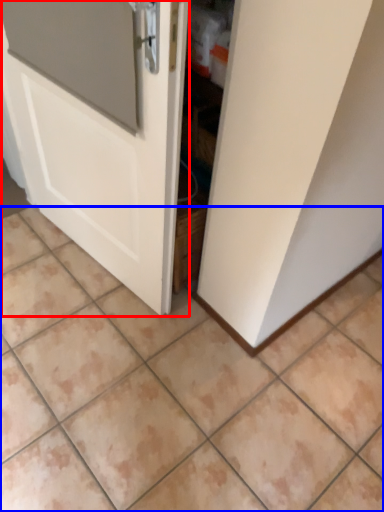
Question: Which object appears farthest to the camera in this image, door (highlighted by a red box) or ceramic tile (highlighted by a blue box)?

Choices:
 (A) door
 (B) ceramic tile

Answer: (B)